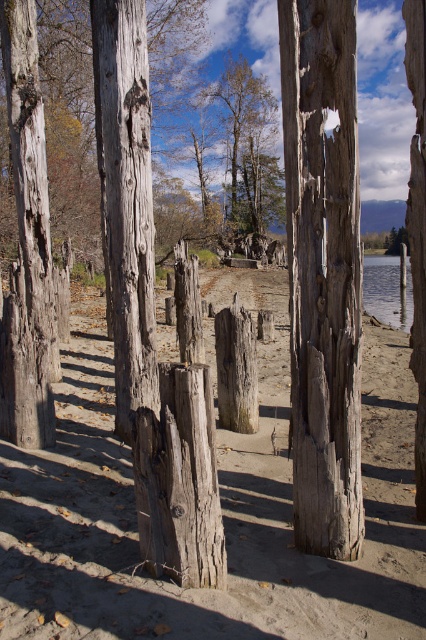
You are standing at the beach looking towards the wooden posts. There are two points marked on the image. The first point is at coordinates point (281, 392) and the second is at point (310, 276). Which point is closer to you?

Point (310, 276) is closer to you because point (281, 392) is behind it.

You are a bird flying over the beach and see the weathered wood posts at center and the weathered wood at center. Which one is taller?

The weathered wood posts at center are much taller than the weathered wood at center.

You are standing at the edge of the beach and want to walk towards the weathered wood posts at center. According to the coordinates provided, in which direction should you head?

The weathered wood posts at center are located at point [221,509], so you should head towards the center of the image to reach them.